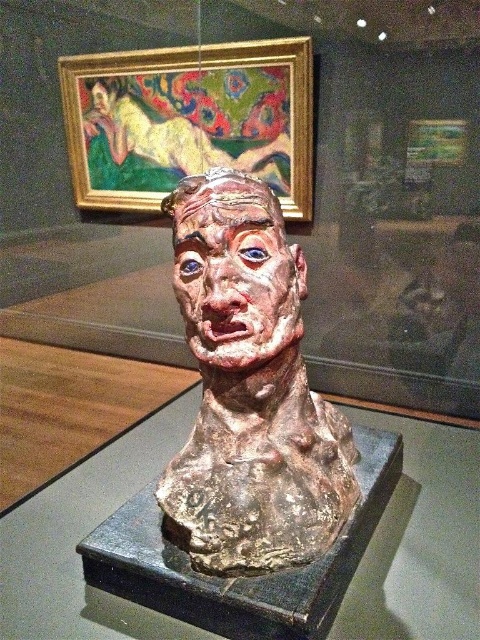
Question: Which point is farther to the camera?

Choices:
 (A) matte clay face at center
 (B) matte clay face at upper center

Answer: (B)

Question: Which point is farther to the camera?

Choices:
 (A) (101, 92)
 (B) (237, 289)

Answer: (A)

Question: Does matte clay face at center appear under matte clay face at upper center?

Choices:
 (A) no
 (B) yes

Answer: (B)

Question: From the image, what is the correct spatial relationship of matte clay bust at center in relation to matte clay face at upper center?

Choices:
 (A) left
 (B) right

Answer: (B)

Question: Does matte clay face at center appear on the right side of matte clay face at upper center?

Choices:
 (A) no
 (B) yes

Answer: (B)

Question: Which point is farther to the camera?

Choices:
 (A) [x=239, y=541]
 (B) [x=199, y=276]

Answer: (B)